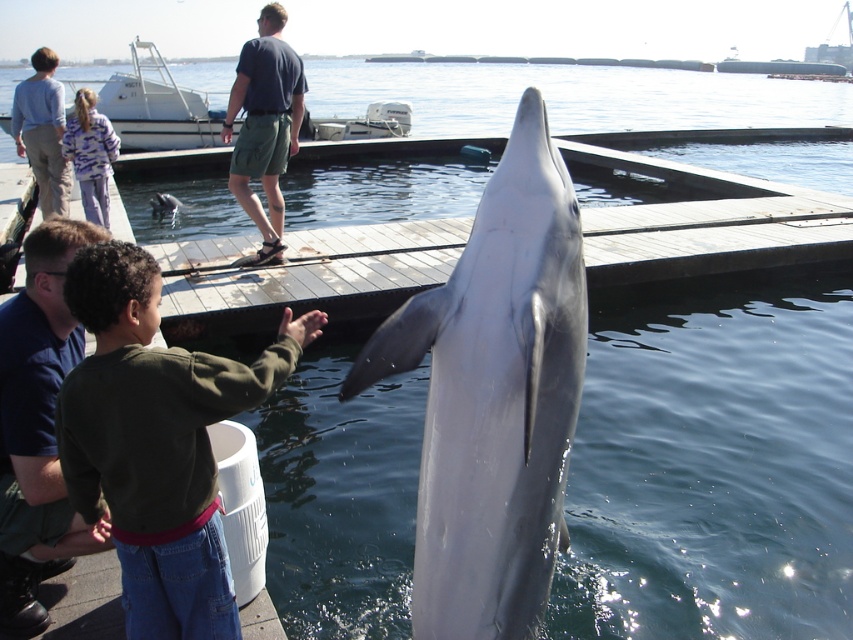
Question: Which object is closer to the camera taking this photo?

Choices:
 (A) blue shirt at upper left
 (B) silvery smooth dolphin at center
 (C) camouflage sweatshirt at upper left
 (D) light blue shirt at upper left

Answer: (B)

Question: Does silvery smooth dolphin at center lie behind blue shirt at upper left?

Choices:
 (A) yes
 (B) no

Answer: (B)

Question: Does silvery smooth dolphin at center appear under blue shirt at upper left?

Choices:
 (A) yes
 (B) no

Answer: (B)

Question: Which point is closer to the camera taking this photo?

Choices:
 (A) (270, 173)
 (B) (514, 534)

Answer: (B)

Question: Which point is closer to the camera?

Choices:
 (A) green cotton shirt at lower left
 (B) silvery smooth dolphin at center

Answer: (B)

Question: Does blue shirt at upper left have a larger size compared to camouflage sweatshirt at upper left?

Choices:
 (A) yes
 (B) no

Answer: (B)